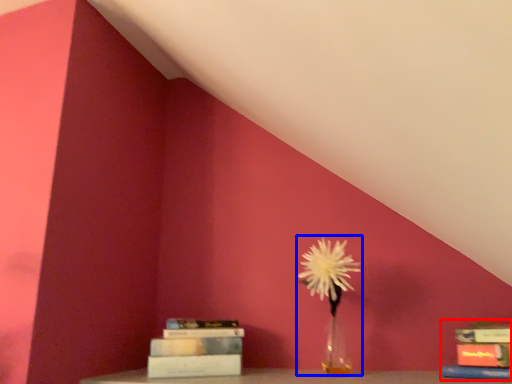
Question: Which object is closer to the camera taking this photo, book (highlighted by a red box) or floral arrangement (highlighted by a blue box)?

Choices:
 (A) book
 (B) floral arrangement

Answer: (A)